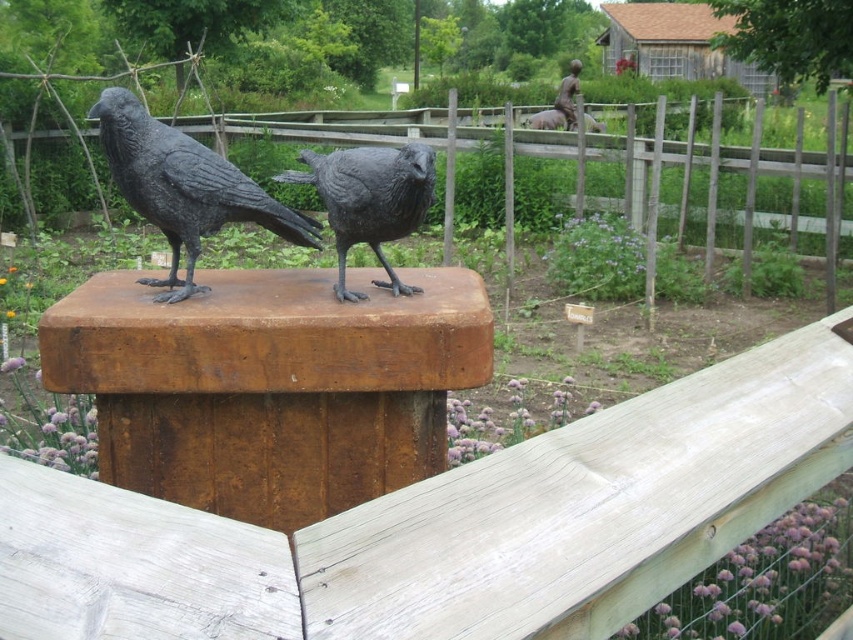
You are a painter standing in the garden and want to paint both the matte black crow at center and the bronze statue at upper center. Which object should you choose if you want to paint the narrower one?

The matte black crow at center is thinner than the bronze statue at upper center, so you should choose the matte black crow at center to paint the narrower one.

You are a bird enthusiast observing two birds on a wooden post in the garden. You notice a shiny black raven at center and a matte black crow at center. Which of these two birds has a greater width?

The shiny black raven at center has a greater width than the matte black crow at center according to the description.

You are a visitor in the garden and want to take a photo of both the shiny black raven at center and the matte black crow at center. Which one should you position to your left to include both in the frame?

You should position the shiny black raven at center to your left since it is already to the left of the matte black crow at center in the image.